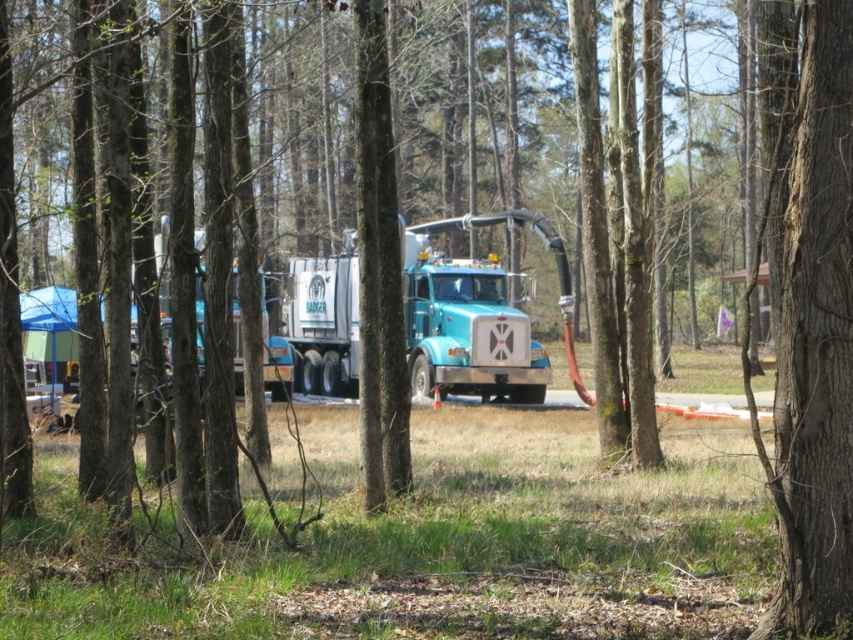
You are standing at the point with coordinates point (844, 150) and want to walk towards the truck parked on the dirt path. Will you pass by point (461, 339) on your way to the truck?

Point (844, 150) is in front of point (461, 339), so yes, you will pass by point (461, 339) on your way to the truck.

In the scene shown: You are standing at the camera position observing the wooded area. There is a point at coordinates point (776, 68). Can you safely walk towards that point without getting too close to the large blue and white truck parked on the dirt path?

The point at coordinates point (776, 68) is 8.59 meters away from the camera position. Since the truck is parked on the dirt path, but the exact distance between the point and the truck isn not provided, it is unclear whether walking towards the point would bring you too close to the truck. Additional information about the truck location relative to the point is needed to determine safety.

You are standing at the edge of the dirt path where the large blue and white truck is parked. You want to walk straight ahead towards the center of the image. Will you encounter the smooth bark tree at center before reaching the middle of the dirt path?

The smooth bark tree at center is located at point 0.483 on the horizontal axis and 0.951 on the vertical axis. Since you are starting from the edge of the dirt path and walking straight ahead towards the center, the tree is positioned closer to the middle of the image. Therefore, you will encounter the smooth bark tree at center before reaching the middle of the dirt path.